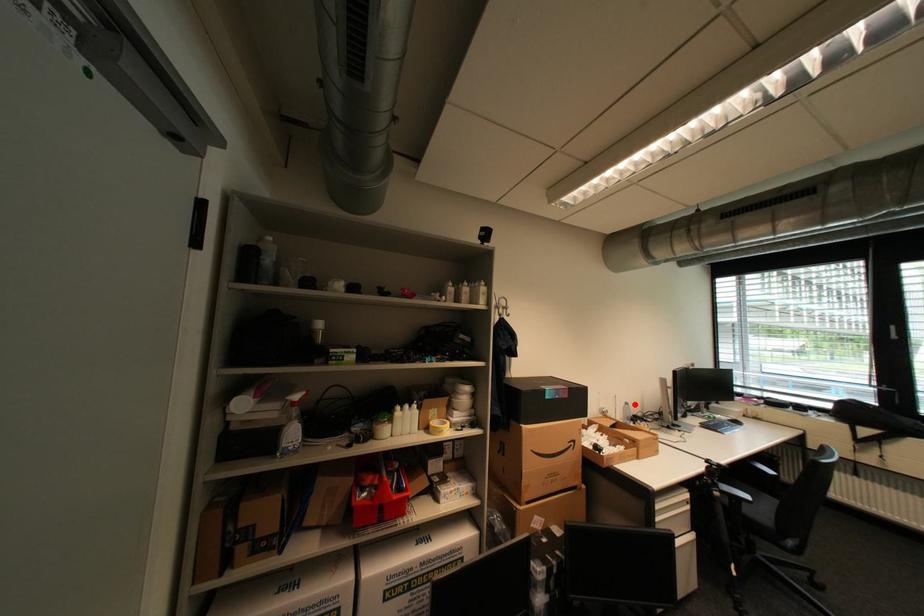
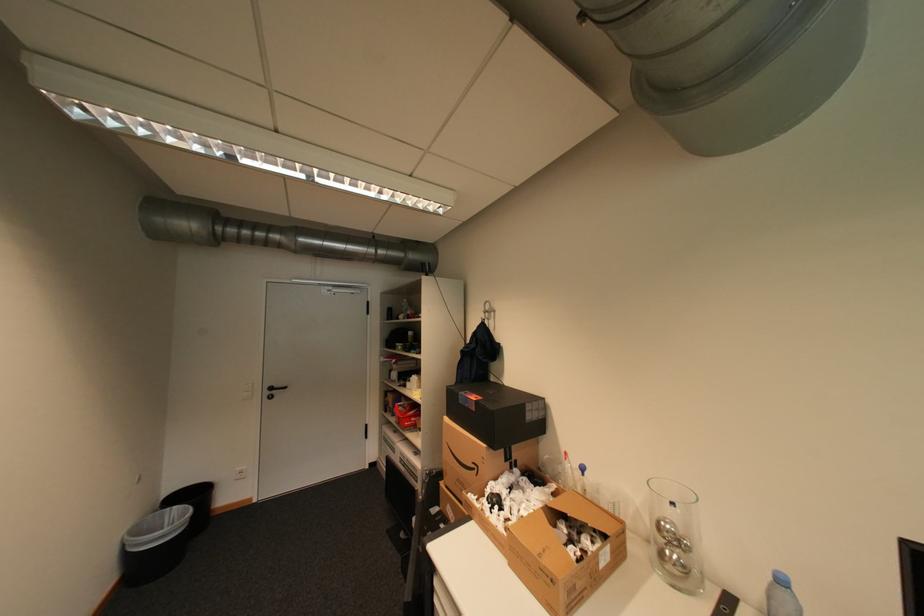
Where in the second image is the point corresponding to the highlighted location from the first image?

(791, 582)